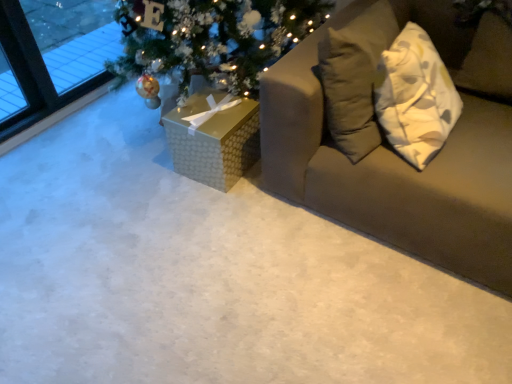
You are a GUI agent. You are given a task and a screenshot of the screen. Output one action in this format:
    pyautogui.click(x=<x>, y=<y>)
    Task: Click on the vacant space positioned to the left of gold textured gift box at center
    The width and height of the screenshot is (512, 384).
    Given the screenshot: What is the action you would take?
    pyautogui.click(x=148, y=172)